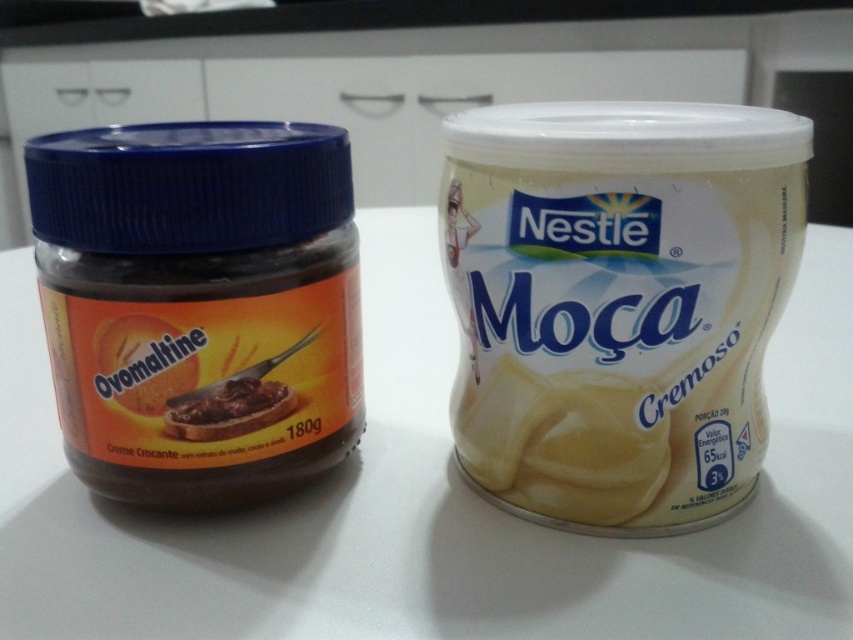
Can you confirm if white creamy tub at center is smaller than dark brown creamy spread at left?

Actually, white creamy tub at center might be larger than dark brown creamy spread at left.

Find the location of a particular element. Image resolution: width=853 pixels, height=640 pixels. white creamy tub at center is located at coordinates (618, 304).

Locate an element on the screen. This screenshot has height=640, width=853. white creamy tub at center is located at coordinates (618, 304).